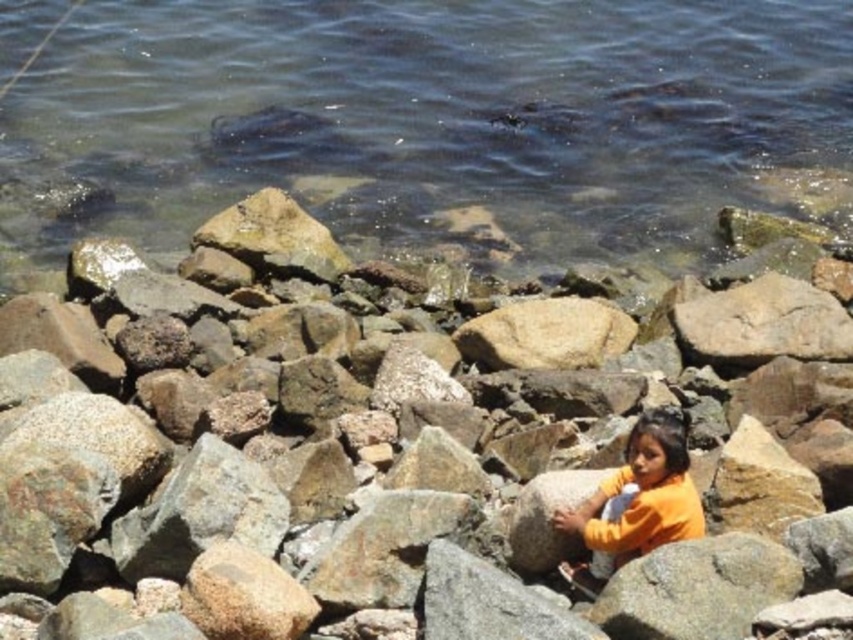
You are a photographer trying to capture the orange cotton shirt at center and the clear water at upper center in the same frame. Based on their positions, which object should you focus on first to ensure both are in the shot?

The clear water at upper center is positioned on the left side of orange cotton shirt at center, so you should focus on the orange cotton shirt at center first to ensure both are in the shot.